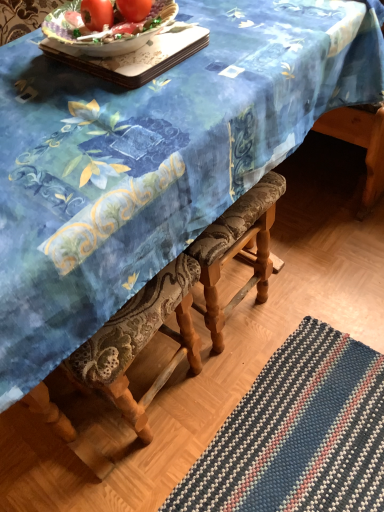
The image size is (384, 512). What do you see at coordinates (96, 14) in the screenshot?
I see `matte red tomato at upper center, which ranks as the second tomato in right-to-left order` at bounding box center [96, 14].

Where is `matte red tomato at upper center, the 1th tomato in the right-to-left sequence`? matte red tomato at upper center, the 1th tomato in the right-to-left sequence is located at coordinates (134, 9).

What do you see at coordinates (134, 9) in the screenshot?
I see `matte red tomato at upper center, the second tomato when ordered from left to right` at bounding box center [134, 9].

Locate an element on the screen. This screenshot has width=384, height=512. porcelain tray at upper center is located at coordinates (134, 56).

Which point is more forward, [130,21] or [106,17]?

The point [130,21] is more forward.

Is matte red tomato at upper center, the second tomato when ordered from left to right, completely or partially outside of matte red tomato at upper center, marked as the first tomato in a left-to-right arrangement?

Yes, matte red tomato at upper center, the second tomato when ordered from left to right, is located beyond the bounds of matte red tomato at upper center, marked as the first tomato in a left-to-right arrangement.

Is matte red tomato at upper center, the 1th tomato in the right-to-left sequence, bigger than matte red tomato at upper center, which ranks as the second tomato in right-to-left order?

No, matte red tomato at upper center, the 1th tomato in the right-to-left sequence, is not bigger than matte red tomato at upper center, which ranks as the second tomato in right-to-left order.

Does matte red tomato at upper center, the second tomato when ordered from left to right, turn towards matte red tomato at upper center, which ranks as the second tomato in right-to-left order?

No, matte red tomato at upper center, the second tomato when ordered from left to right, does not turn towards matte red tomato at upper center, which ranks as the second tomato in right-to-left order.

Considering the positions of objects matte red tomato at upper center, marked as the first tomato in a left-to-right arrangement, and matte red tomato at upper center, the 1th tomato in the right-to-left sequence, in the image provided, who is more to the left, matte red tomato at upper center, marked as the first tomato in a left-to-right arrangement, or matte red tomato at upper center, the 1th tomato in the right-to-left sequence,?

matte red tomato at upper center, marked as the first tomato in a left-to-right arrangement.

Can you confirm if matte red tomato at upper center, marked as the first tomato in a left-to-right arrangement, is thinner than matte red tomato at upper center, the 1th tomato in the right-to-left sequence?

Incorrect, the width of matte red tomato at upper center, marked as the first tomato in a left-to-right arrangement, is not less than that of matte red tomato at upper center, the 1th tomato in the right-to-left sequence.

Is matte red tomato at upper center, marked as the first tomato in a left-to-right arrangement, positioned before matte red tomato at upper center, the 1th tomato in the right-to-left sequence?

Yes, matte red tomato at upper center, marked as the first tomato in a left-to-right arrangement, is closer to the viewer.

Locate an element on the screen. Image resolution: width=384 pixels, height=512 pixels. tomato that is on the right side of matte red tomato at upper center, which ranks as the second tomato in right-to-left order is located at coordinates (134, 9).

The height and width of the screenshot is (512, 384). What are the coordinates of `tomato located on the right of porcelain tray at upper center` in the screenshot? It's located at (134, 9).

Is matte red tomato at upper center, the 1th tomato in the right-to-left sequence, inside porcelain tray at upper center?

No, porcelain tray at upper center does not contain matte red tomato at upper center, the 1th tomato in the right-to-left sequence.

Is point (152, 48) less distant than point (132, 6)?

Yes.

What's the angular difference between porcelain tray at upper center and matte red tomato at upper center, the 1th tomato in the right-to-left sequence,'s facing directions?

They differ by 0.935 degrees in their facing directions.

Based on their sizes in the image, would you say matte red tomato at upper center, the second tomato when ordered from left to right, is bigger or smaller than porcelain tray at upper center?

matte red tomato at upper center, the second tomato when ordered from left to right, is smaller than porcelain tray at upper center.

Is point (151, 6) closer to camera compared to point (164, 39)?

That is False.

Is matte red tomato at upper center, the 1th tomato in the right-to-left sequence, aimed at porcelain tray at upper center?

No, matte red tomato at upper center, the 1th tomato in the right-to-left sequence, is not facing towards porcelain tray at upper center.

Which is behind, point (106, 22) or point (120, 74)?

The point (106, 22) is more distant.

From the image's perspective, does matte red tomato at upper center, marked as the first tomato in a left-to-right arrangement, appear lower than porcelain tray at upper center?

No, from the image's perspective, matte red tomato at upper center, marked as the first tomato in a left-to-right arrangement, is not beneath porcelain tray at upper center.

Is porcelain tray at upper center a part of matte red tomato at upper center, marked as the first tomato in a left-to-right arrangement?

No, porcelain tray at upper center is not surrounded by matte red tomato at upper center, marked as the first tomato in a left-to-right arrangement.

Which of these two, matte red tomato at upper center, marked as the first tomato in a left-to-right arrangement, or porcelain tray at upper center, stands shorter?

porcelain tray at upper center is shorter.

Looking at this image, from the image's perspective, which is below, porcelain tray at upper center or matte red tomato at upper center, marked as the first tomato in a left-to-right arrangement?

porcelain tray at upper center, from the image's perspective.

Is porcelain tray at upper center turned away from matte red tomato at upper center, which ranks as the second tomato in right-to-left order?

No, porcelain tray at upper center is not facing the opposite direction of matte red tomato at upper center, which ranks as the second tomato in right-to-left order.

Is there a large distance between porcelain tray at upper center and matte red tomato at upper center, which ranks as the second tomato in right-to-left order?

Actually, porcelain tray at upper center and matte red tomato at upper center, which ranks as the second tomato in right-to-left order, are a little close together.

Identify the location of tomato located above the matte red tomato at upper center, which ranks as the second tomato in right-to-left order (from the image's perspective). (134, 9).

The image size is (384, 512). Find the location of `tomato lying behind the matte red tomato at upper center, which ranks as the second tomato in right-to-left order`. tomato lying behind the matte red tomato at upper center, which ranks as the second tomato in right-to-left order is located at coordinates (134, 9).

When comparing their distances from porcelain tray at upper center, does matte red tomato at upper center, which ranks as the second tomato in right-to-left order, or matte red tomato at upper center, the second tomato when ordered from left to right, seem closer?

Based on the image, matte red tomato at upper center, the second tomato when ordered from left to right, appears to be nearer to porcelain tray at upper center.

Based on their spatial positions, is porcelain tray at upper center or matte red tomato at upper center, the 1th tomato in the right-to-left sequence, closer to matte red tomato at upper center, which ranks as the second tomato in right-to-left order?

matte red tomato at upper center, the 1th tomato in the right-to-left sequence, is positioned closer to the anchor matte red tomato at upper center, which ranks as the second tomato in right-to-left order.

Considering their positions, is matte red tomato at upper center, the second tomato when ordered from left to right, positioned closer to matte red tomato at upper center, which ranks as the second tomato in right-to-left order, than porcelain tray at upper center?

The object closer to matte red tomato at upper center, which ranks as the second tomato in right-to-left order, is matte red tomato at upper center, the second tomato when ordered from left to right.

Which object lies nearer to the anchor point porcelain tray at upper center, matte red tomato at upper center, the 1th tomato in the right-to-left sequence, or matte red tomato at upper center, which ranks as the second tomato in right-to-left order?

matte red tomato at upper center, the 1th tomato in the right-to-left sequence, lies closer to porcelain tray at upper center than the other object.

Based on their spatial positions, is porcelain tray at upper center or matte red tomato at upper center, which ranks as the second tomato in right-to-left order, further from matte red tomato at upper center, the 1th tomato in the right-to-left sequence?

The object further to matte red tomato at upper center, the 1th tomato in the right-to-left sequence, is porcelain tray at upper center.

From the image, which object appears to be nearer to matte red tomato at upper center, the second tomato when ordered from left to right, matte red tomato at upper center, marked as the first tomato in a left-to-right arrangement, or porcelain tray at upper center?

matte red tomato at upper center, marked as the first tomato in a left-to-right arrangement, is closer to matte red tomato at upper center, the second tomato when ordered from left to right.

Identify the location of tomato between matte red tomato at upper center, the second tomato when ordered from left to right, and porcelain tray at upper center in the up-down direction. (96, 14).